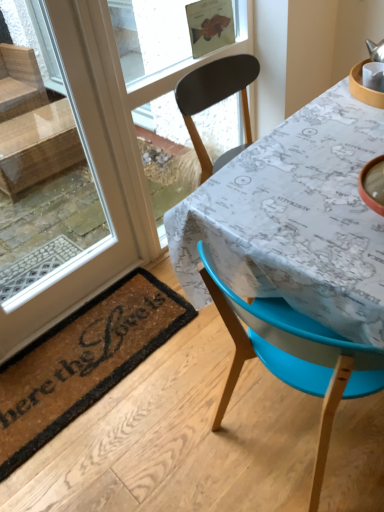
Question: Considering the relative sizes of blue plastic chair at lower right and map-patterned fabric at center in the image provided, is blue plastic chair at lower right smaller than map-patterned fabric at center?

Choices:
 (A) no
 (B) yes

Answer: (B)

Question: From the image's perspective, would you say blue plastic chair at lower right is shown under map-patterned fabric at center?

Choices:
 (A) yes
 (B) no

Answer: (A)

Question: Does blue plastic chair at lower right appear on the right side of map-patterned fabric at center?

Choices:
 (A) no
 (B) yes

Answer: (A)

Question: Are blue plastic chair at lower right and map-patterned fabric at center making contact?

Choices:
 (A) no
 (B) yes

Answer: (A)

Question: Considering the relative sizes of blue plastic chair at lower right and map-patterned fabric at center in the image provided, is blue plastic chair at lower right thinner than map-patterned fabric at center?

Choices:
 (A) yes
 (B) no

Answer: (A)

Question: Can you confirm if blue plastic chair at lower right is positioned to the left of map-patterned fabric at center?

Choices:
 (A) no
 (B) yes

Answer: (B)

Question: Does transparent glass window screen at upper center have a greater height compared to brown coir mat at lower left?

Choices:
 (A) yes
 (B) no

Answer: (A)

Question: Can you confirm if transparent glass window screen at upper center is positioned to the right of brown coir mat at lower left?

Choices:
 (A) yes
 (B) no

Answer: (A)

Question: Can you confirm if transparent glass window screen at upper center is smaller than brown coir mat at lower left?

Choices:
 (A) no
 (B) yes

Answer: (A)

Question: Is brown coir mat at lower left completely or partially inside transparent glass window screen at upper center?

Choices:
 (A) no
 (B) yes

Answer: (A)

Question: Does transparent glass window screen at upper center have a greater width compared to brown coir mat at lower left?

Choices:
 (A) yes
 (B) no

Answer: (B)

Question: From a real-world perspective, is transparent glass window screen at upper center located higher than brown coir mat at lower left?

Choices:
 (A) no
 (B) yes

Answer: (B)

Question: Is map-patterned fabric at center completely or partially outside of blue plastic chair at lower right?

Choices:
 (A) no
 (B) yes

Answer: (B)